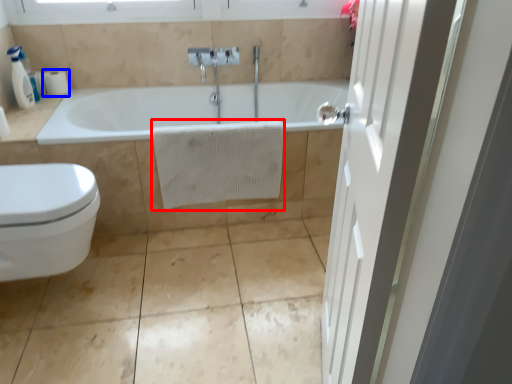
Question: Which point is closer to the camera, bath towel (highlighted by a red box) or toilet paper (highlighted by a blue box)?

Choices:
 (A) bath towel
 (B) toilet paper

Answer: (A)